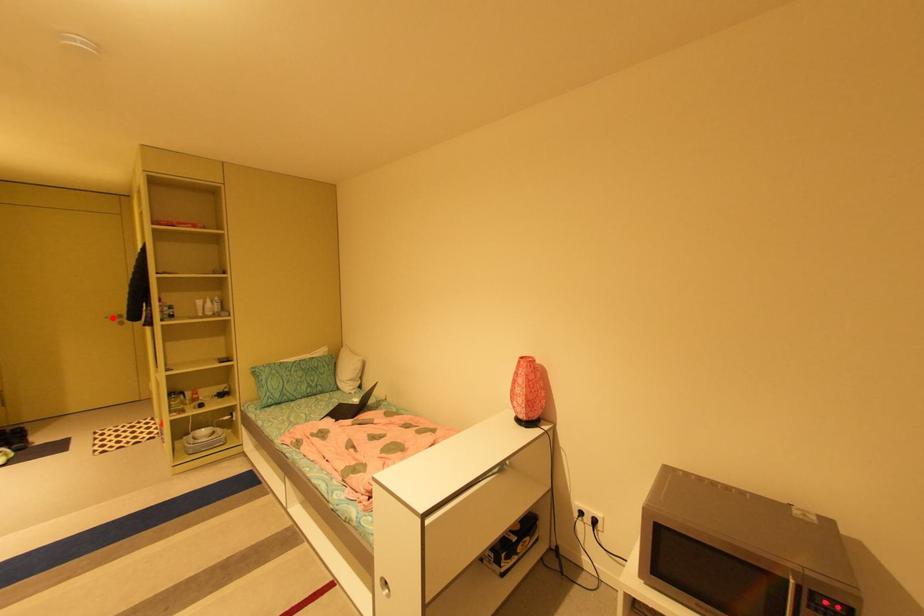
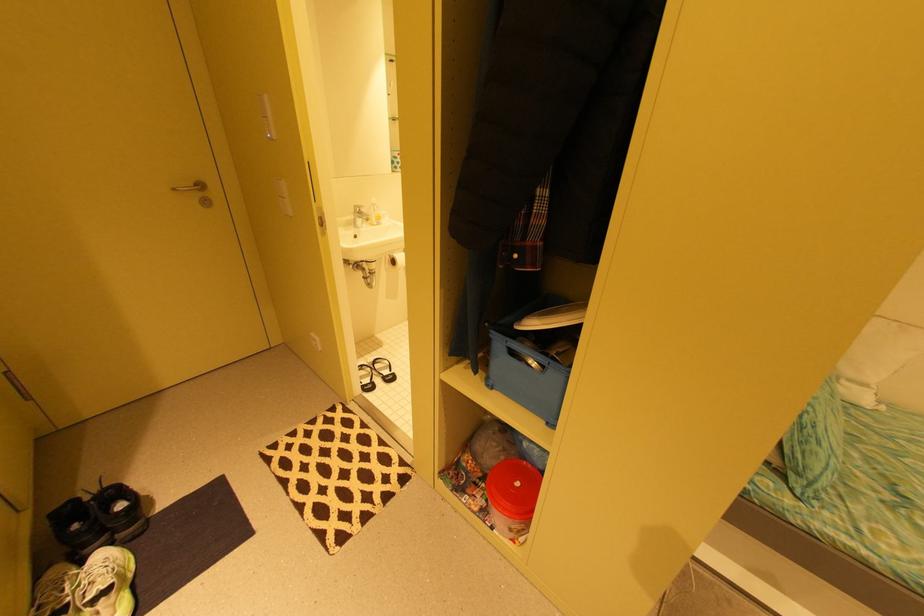
Find the pixel in the second image that matches the highlighted location in the first image.

(179, 190)